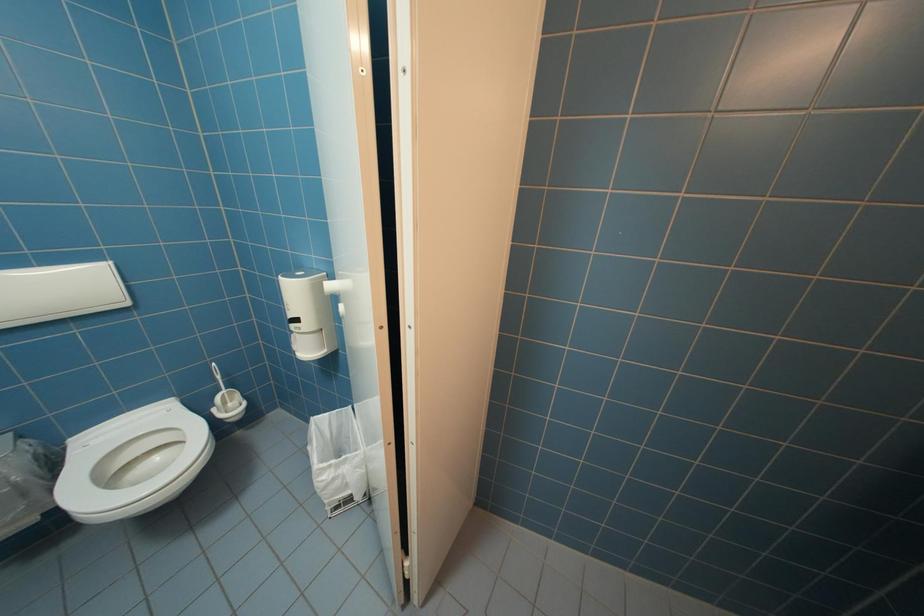
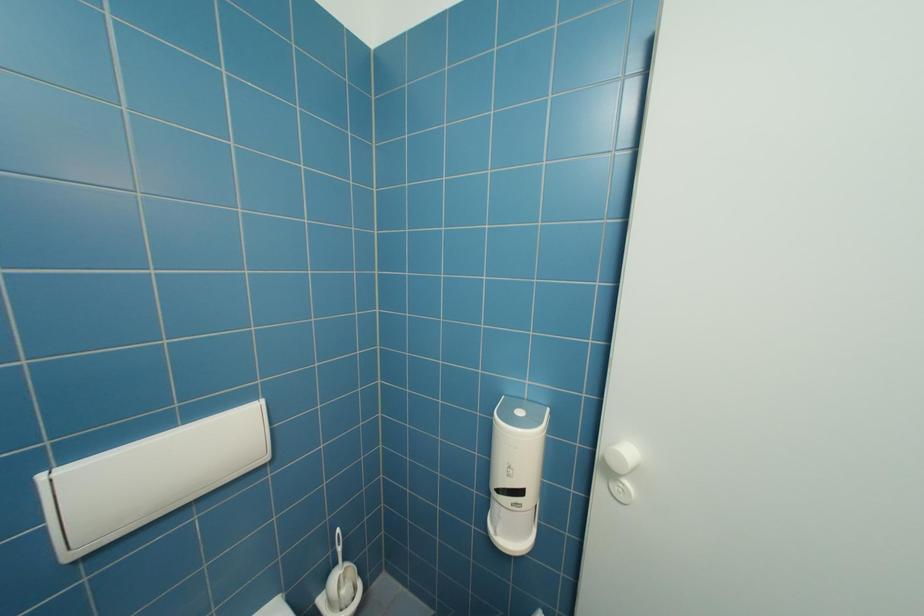
Question: Based on the continuous images, in which direction is the camera rotating? Reply with the corresponding letter.

Choices:
 (A) Left
 (B) Right
 (C) Up
 (D) Down

Answer: (C)